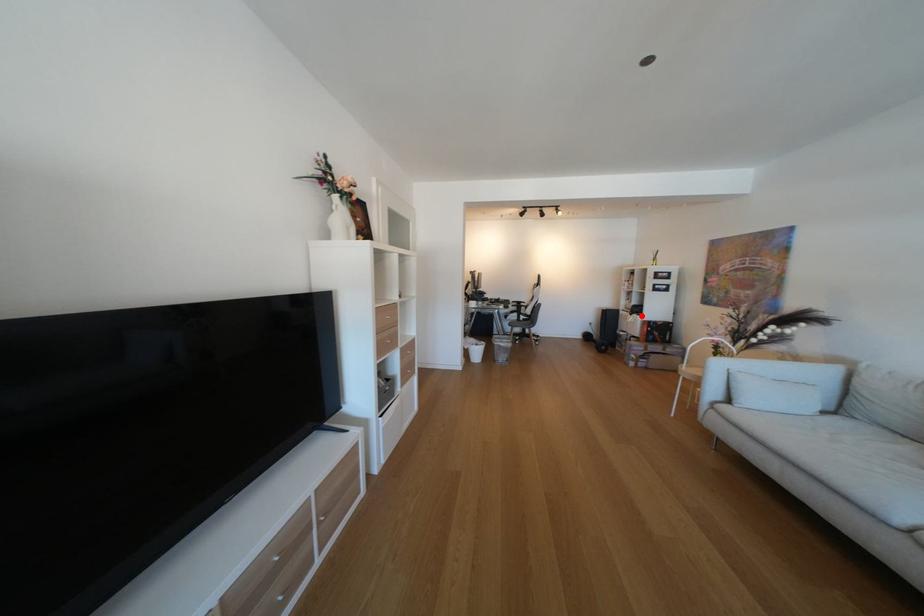
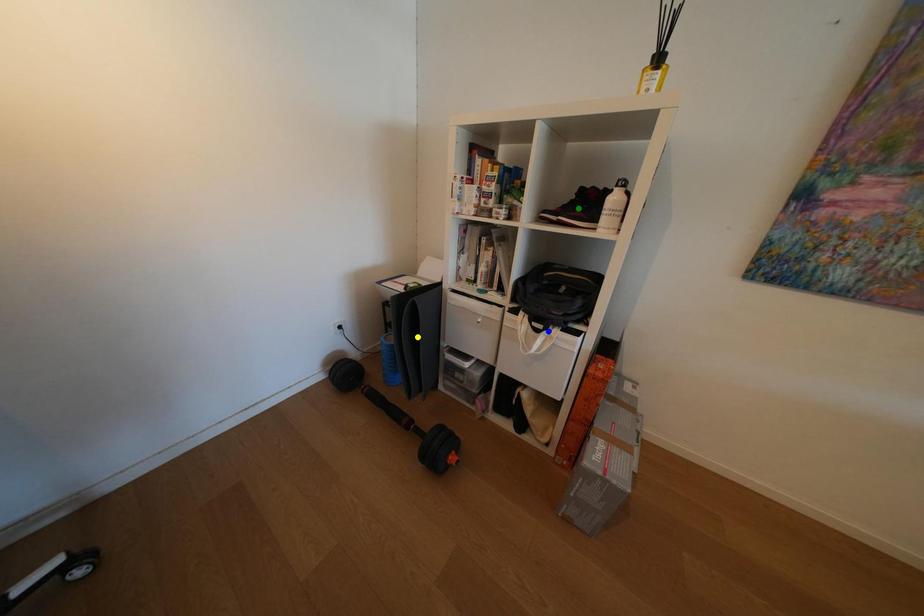
Question: I am providing you with two images of the same scene from different viewpoints. A red point is marked on the first image. You are given multiple points on the second image. Which point in image 2 is actually the same real-world point as the red point in image 1?

Choices:
 (A) blue point
 (B) yellow point
 (C) green point

Answer: (A)